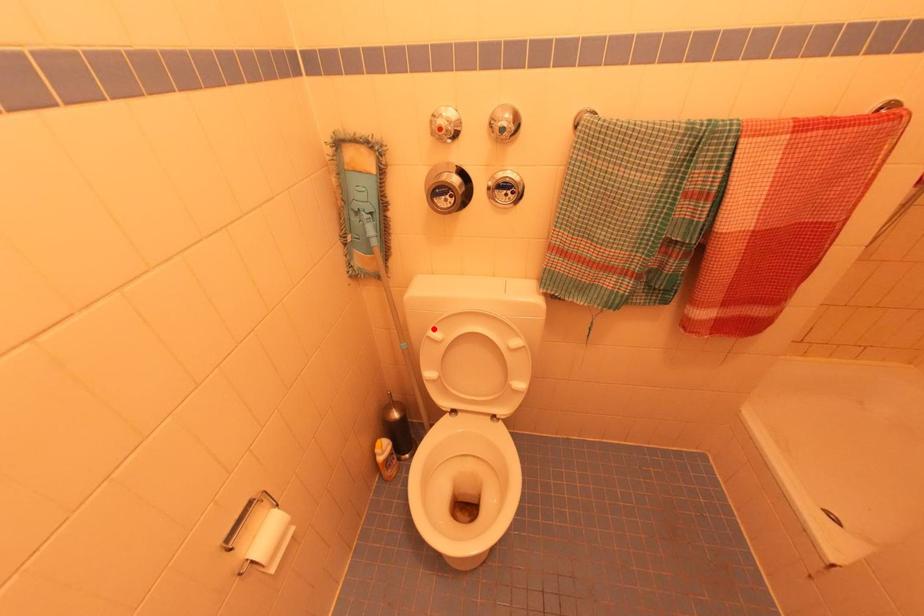
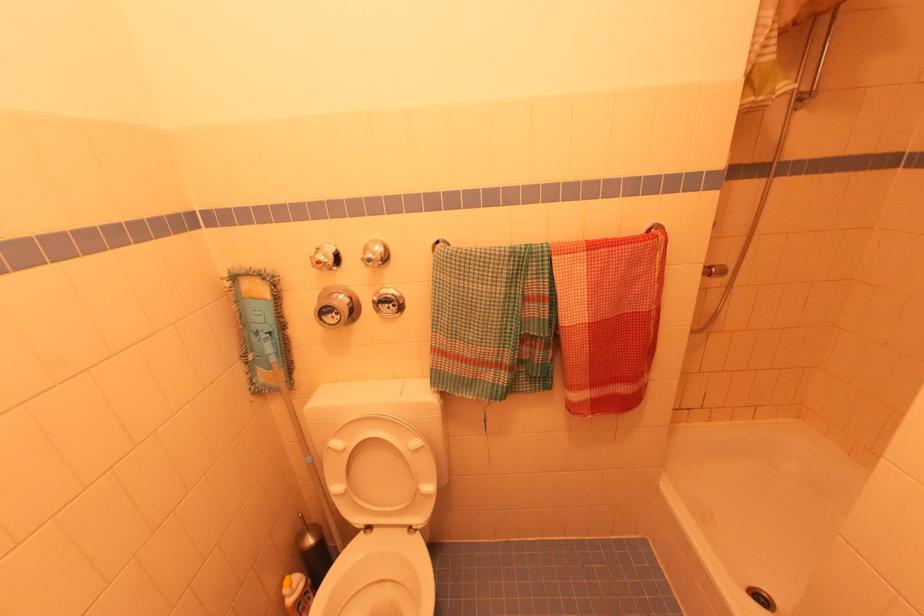
Locate, in the second image, the point that corresponds to the highlighted location in the first image.

(334, 439)